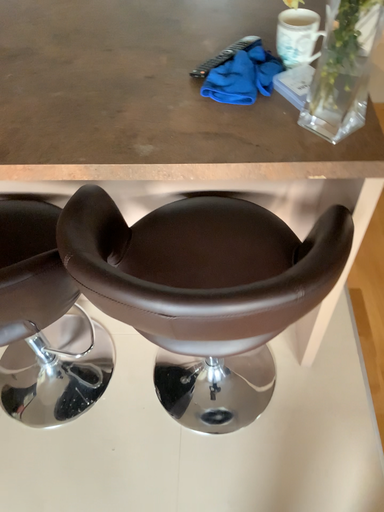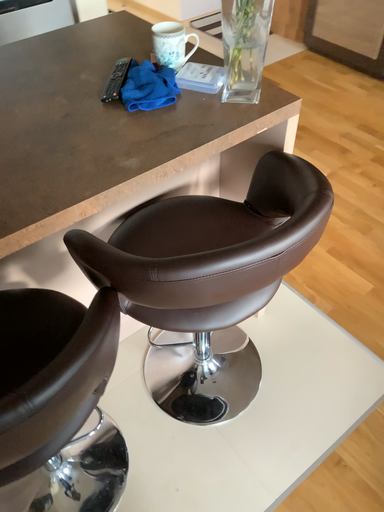
Question: How did the camera likely rotate when shooting the video?

Choices:
 (A) rotated upward
 (B) rotated downward

Answer: (A)